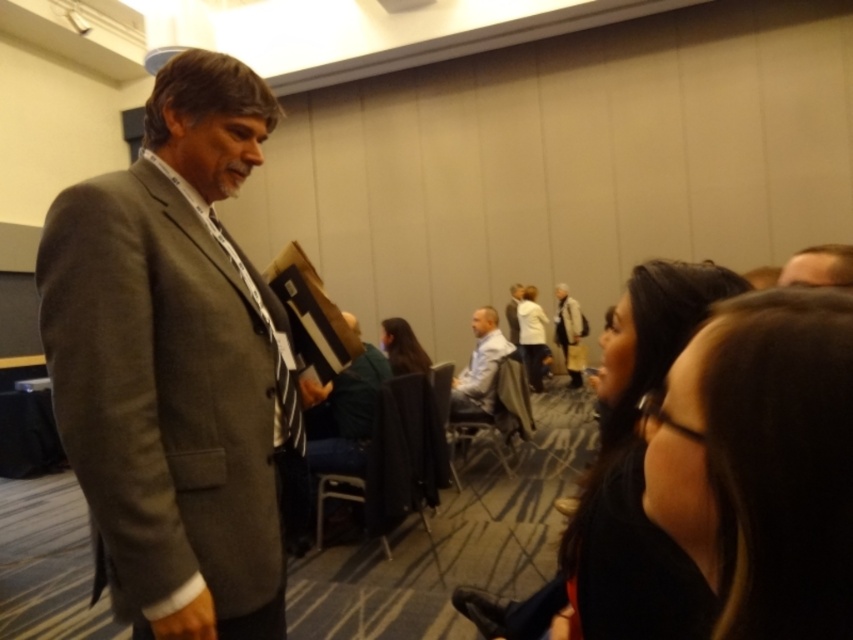
You are standing at the camera position and want to sit down. Is the black fabric chair at center within reach to sit on?

The black fabric chair at center is 3.00 meters from the camera, so it is within reach to sit on.

You are attending a conference and want to sit down. You see a black fabric chair at center and a person with light brown hair at upper right. Which object is closer to you?

The black fabric chair at center is closer to you because the light brown hair at upper right is behind it.

You are attending a conference and need to sit down. There is a metallic gray chair at center and a light gray fabric jacket at center. Which object is shorter and therefore more suitable for sitting?

The metallic gray chair at center is shorter than the light gray fabric jacket at center, so it is more suitable for sitting.